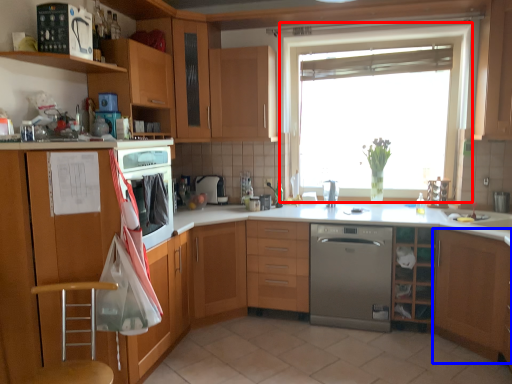
Question: Which object appears closest to the camera in this image, window (highlighted by a red box) or cabinetry (highlighted by a blue box)?

Choices:
 (A) window
 (B) cabinetry

Answer: (B)